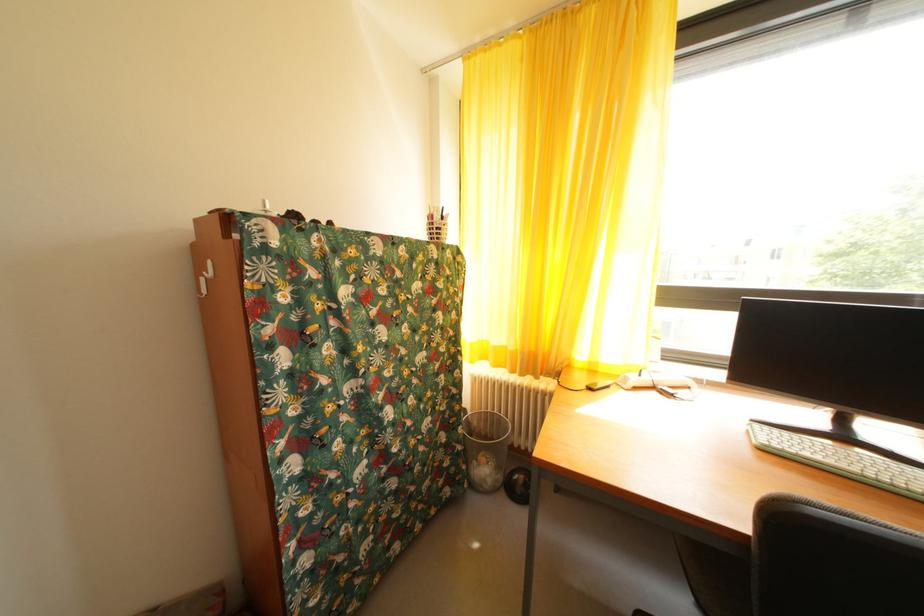
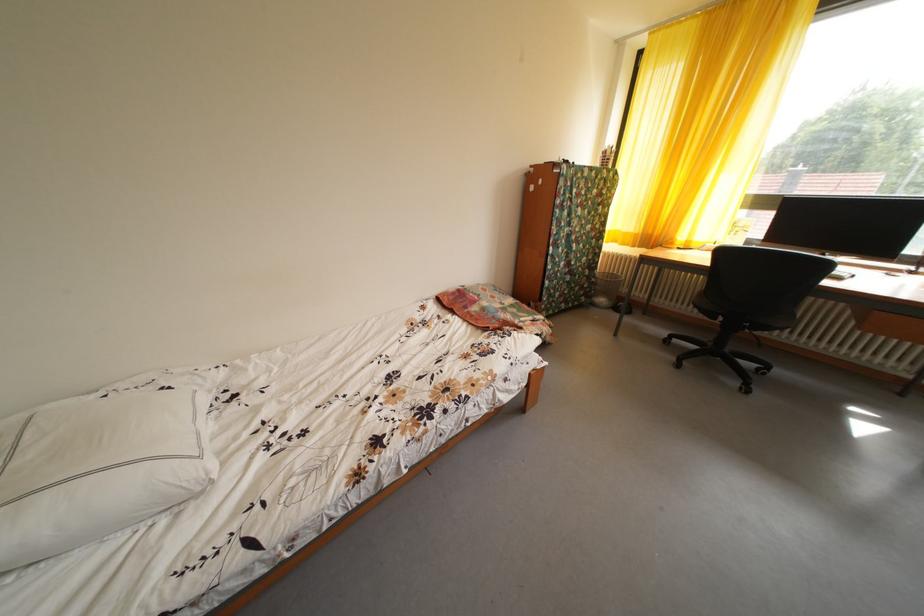
Question: In a continuous first-person perspective shot, in which direction is the camera moving?

Choices:
 (A) Left
 (B) Right
 (C) Forward
 (D) Backward

Answer: (D)